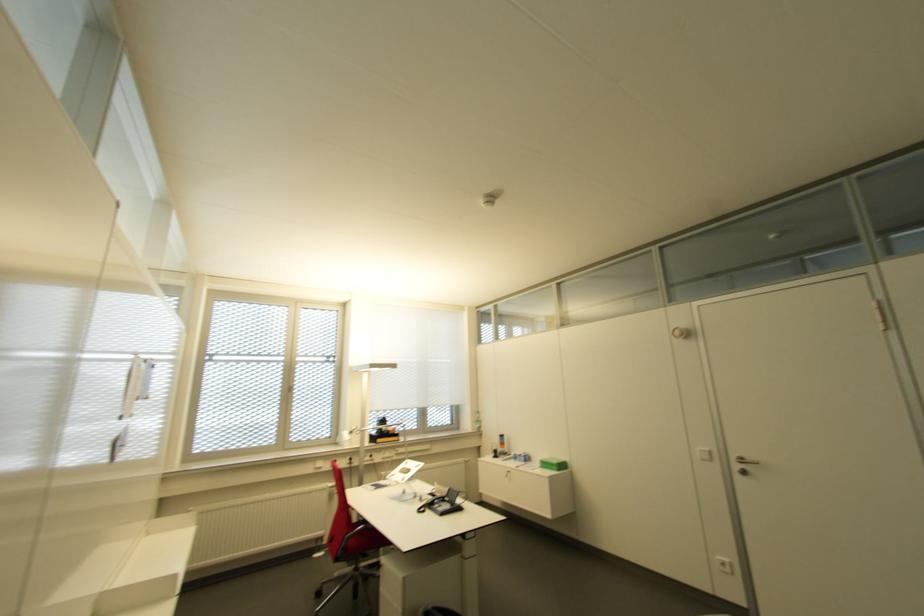
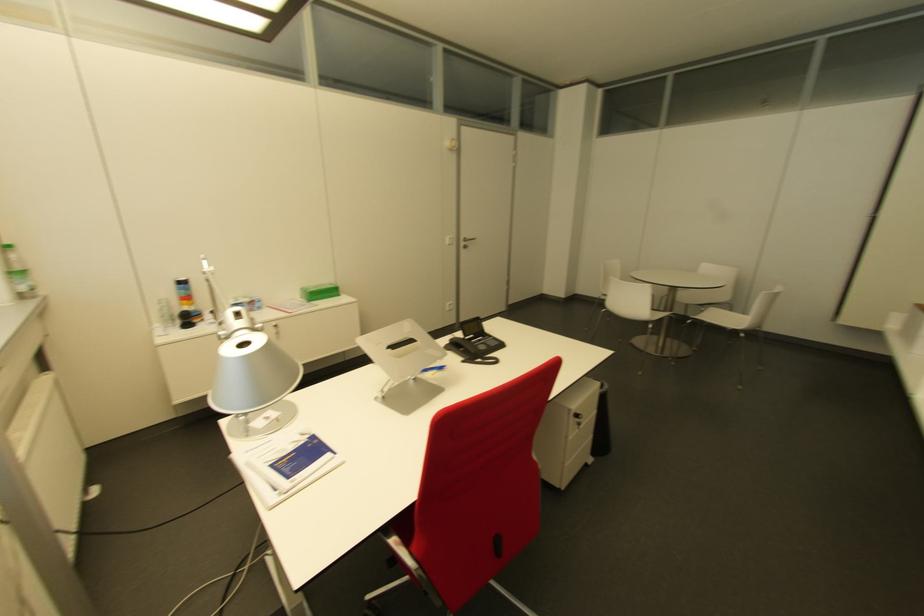
Where in the second image is the point corresponding to point 743,474 from the first image?

(463, 246)